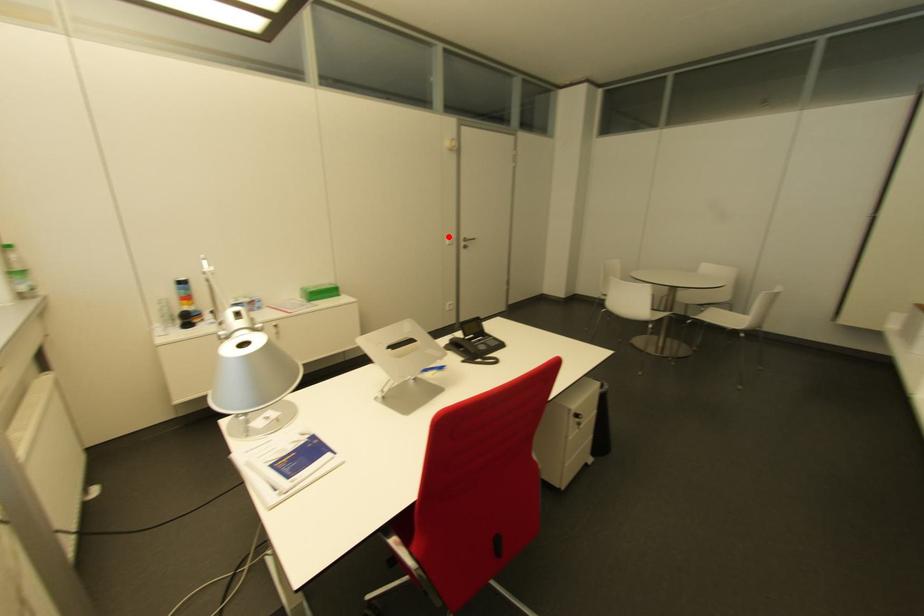
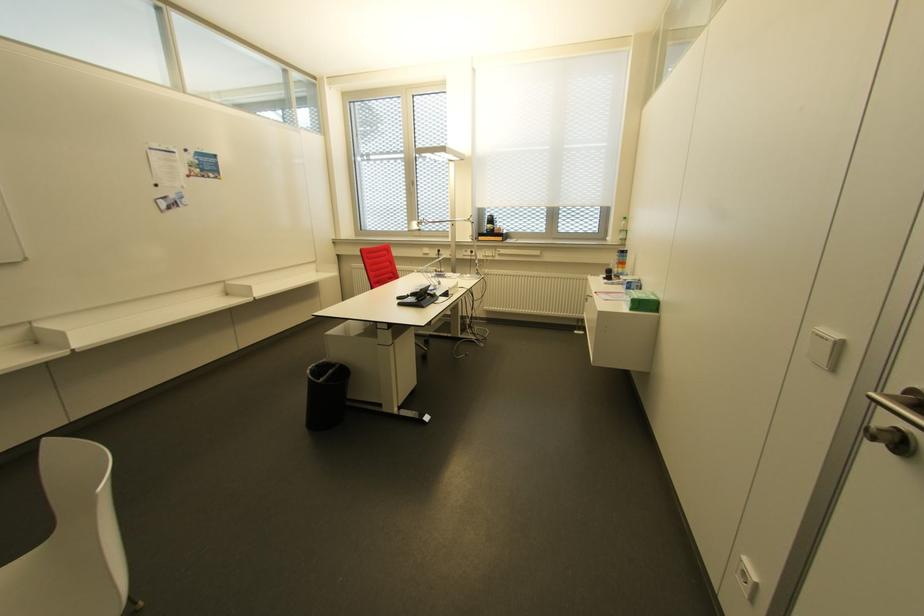
Question: I am providing you with two images of the same scene from different viewpoints. In image1, a red point is highlighted. Considering the same 3D point in image2, which of the following is correct?

Choices:
 (A) It is closer
 (B) It is farther

Answer: (B)